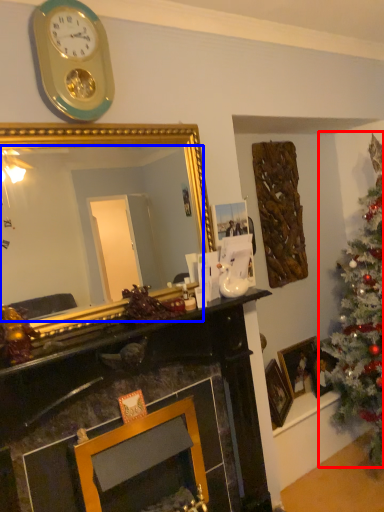
Question: Among these objects, which one is farthest to the camera, christmas tree (highlighted by a red box) or mirror (highlighted by a blue box)?

Choices:
 (A) christmas tree
 (B) mirror

Answer: (A)